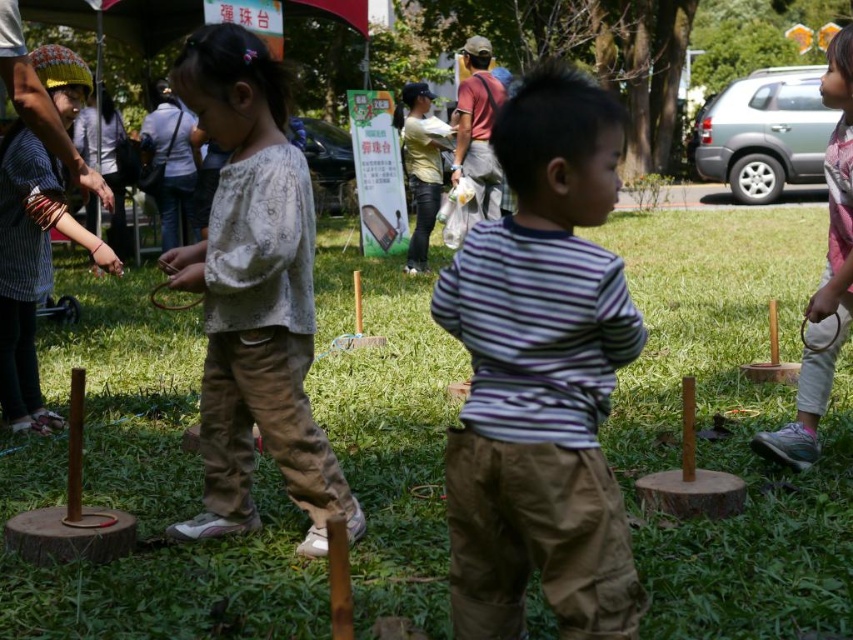
You are a photographer standing at the edge of the park. You want to take a photo of the light beige cotton shirt at center and the green grass at center. Which object should you focus on first if you want to capture both in the same frame?

The light beige cotton shirt at center should be focused on first because it is closer to the photographer than the green grass at center, which is to the right of it.